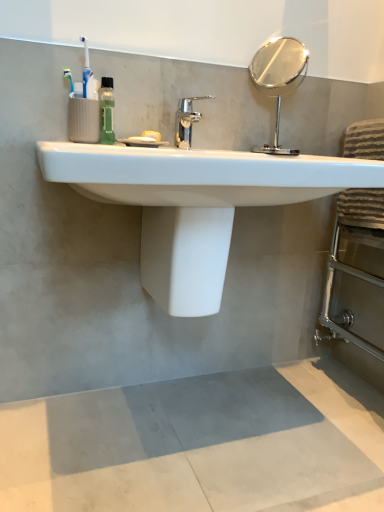
Where is `vacant space underneath white glossy toilet bowl at center (from a real-world perspective)`? vacant space underneath white glossy toilet bowl at center (from a real-world perspective) is located at coordinates (180, 403).